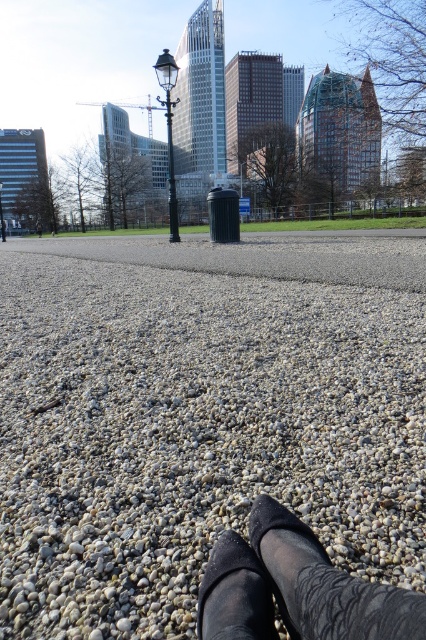
You are a delivery person standing on the gray pebbled gravel at center. You need to place a package on the black fabric shoes at center. Can you reach the shoes without moving your feet?

The distance between the gray pebbled gravel at center and the black fabric shoes at center is 4.65 feet. Since you are standing on the gravel, you would need to stretch or step forward to reach the shoes, which are about 4.65 feet away. However, if you cannot move your feet, you might not be able to reach them comfortably.

From the picture: You are a photographer standing at the end of the pebbled pathway. You notice two shoes in the scene. Which one is bigger between the black fabric shoes at center and the black suede shoe at lower center?

The black fabric shoes at center are larger in size compared to the black suede shoe at lower center.

You are standing on the gray pebbled gravel at center and want to step onto the black suede shoe at lower center. Can you do this without moving your feet?

The gray pebbled gravel at center is closer to you than the black suede shoe at lower center, so you cannot step onto it without moving your feet.